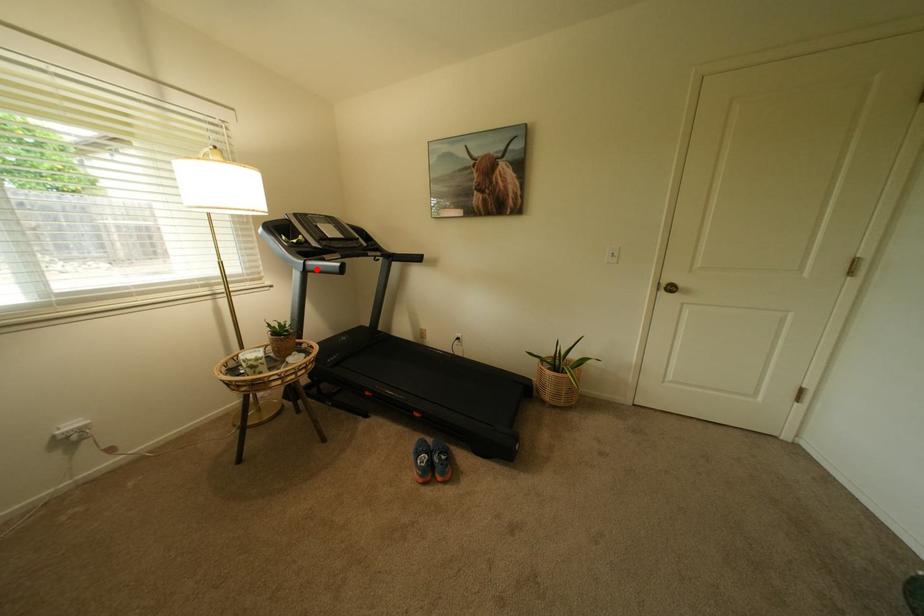
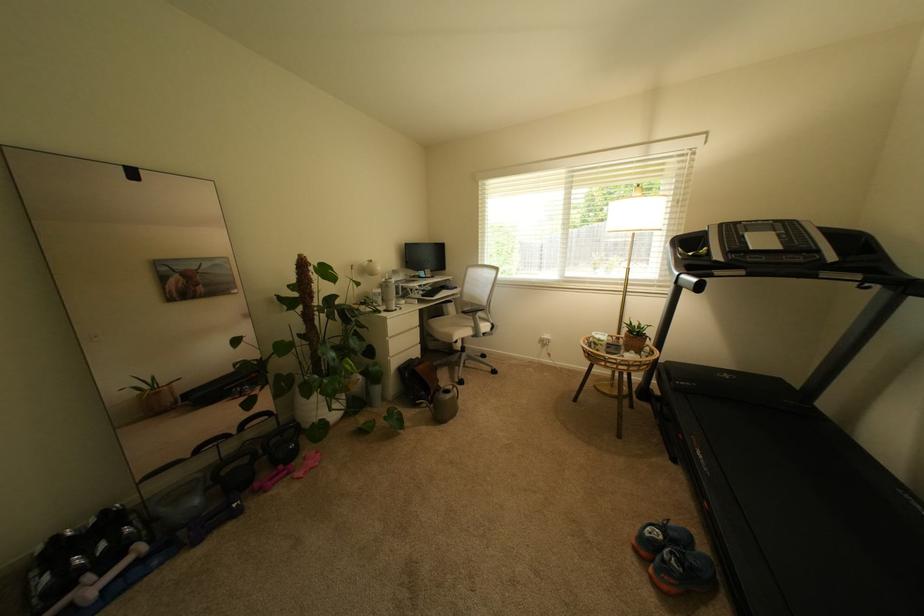
Where in the second image is the point corresponding to the highlighted location from the first image?

(688, 283)